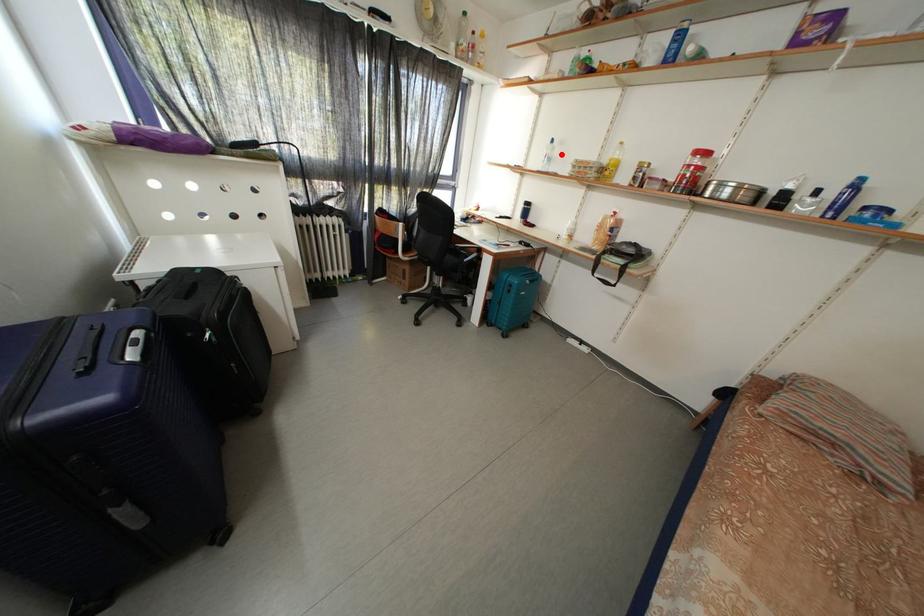
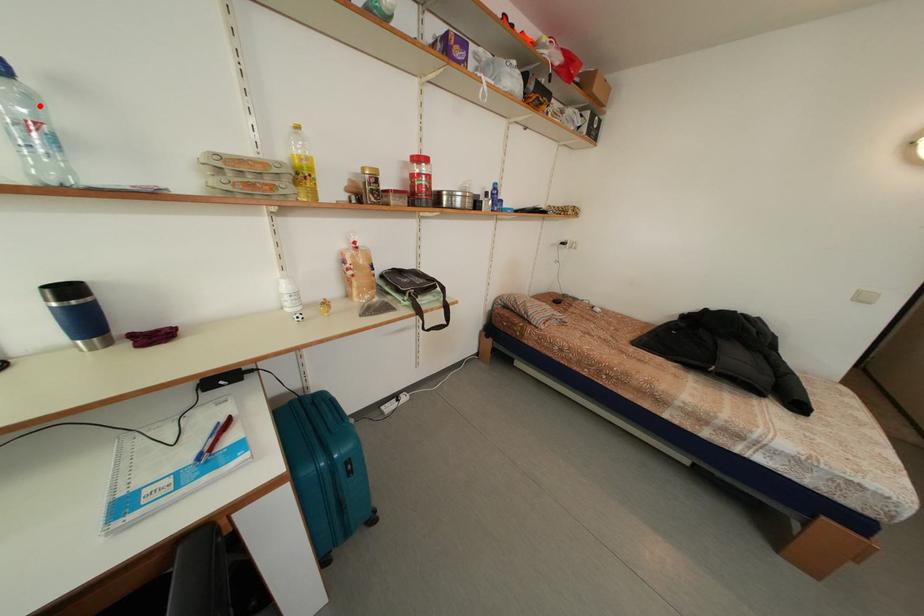
I am providing you with two images of the same scene from different viewpoints. A red point is marked on the first image and another point is marked on the second image. Does the point marked in image1 correspond to the same location as the one in image2?

Yes